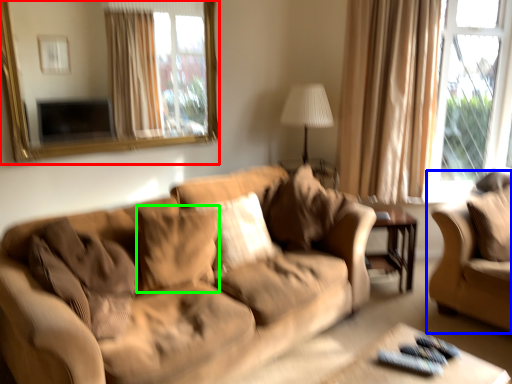
Question: Considering the real-world distances, which object is closest to mirror (highlighted by a red box)? studio couch (highlighted by a blue box) or pillow (highlighted by a green box).

Choices:
 (A) studio couch
 (B) pillow

Answer: (B)